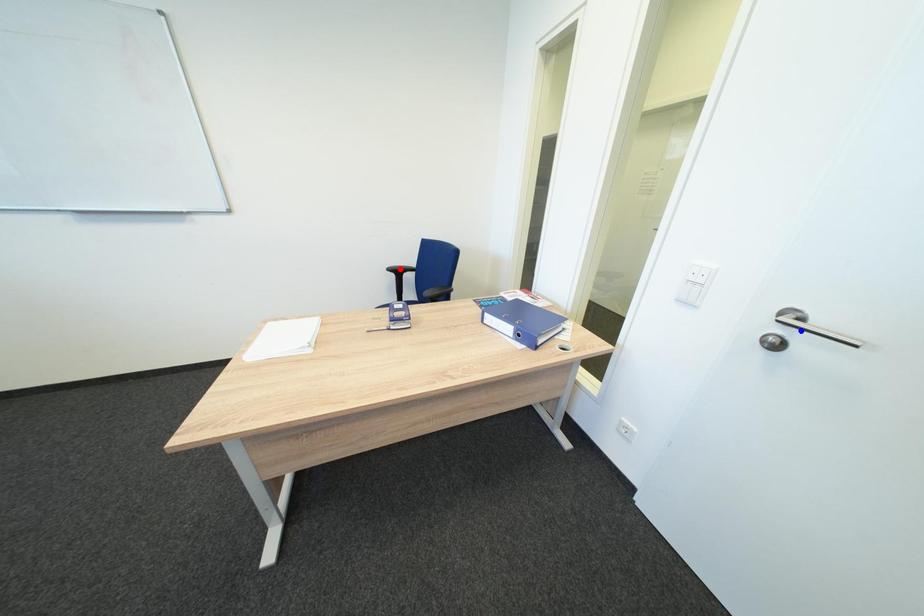
Question: Two points are marked on the image. Which point is closer to the camera?

Choices:
 (A) Blue point is closer.
 (B) Red point is closer.

Answer: (A)